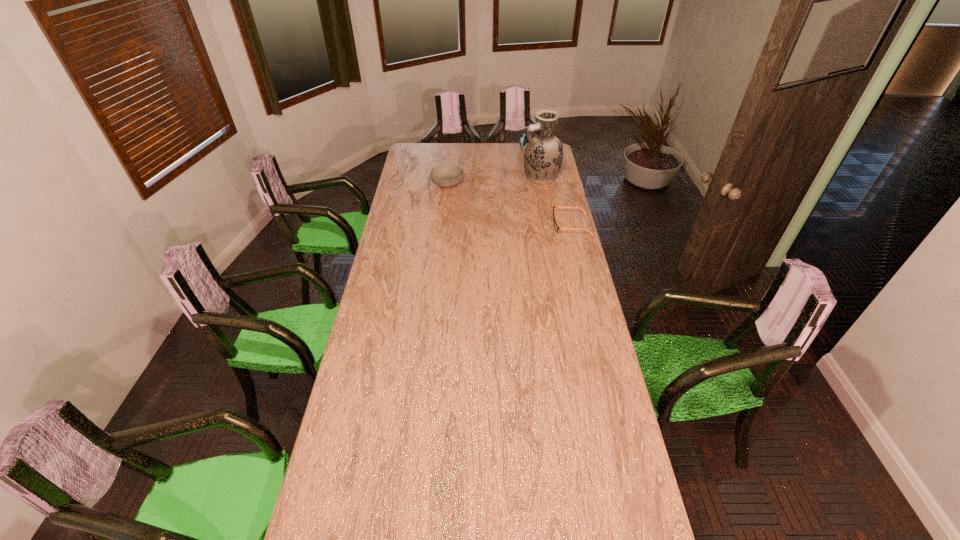
The image size is (960, 540). I want to click on headset positioned at the right edge, so click(522, 138).

At what (x,y) coordinates should I click in order to perform the action: click on object that is at the far right corner. Please return your answer as a coordinate pair (x, y). Looking at the image, I should click on (522, 138).

In the image, there is a desktop. At what (x,y) coordinates should I click in order to perform the action: click on vacant space at the far edge. Please return your answer as a coordinate pair (x, y). The image size is (960, 540). Looking at the image, I should click on (520, 151).

The image size is (960, 540). Identify the location of vacant space at the near edge of the desktop. (505, 508).

Where is `free space at the left edge of the desktop`? This screenshot has width=960, height=540. free space at the left edge of the desktop is located at coordinates (374, 422).

Identify the location of free location at the right edge. (562, 313).

In the image, there is a desktop. At what (x,y) coordinates should I click in order to perform the action: click on vacant area at the far left corner. Please return your answer as a coordinate pair (x, y). Looking at the image, I should click on (407, 155).

At what (x,y) coordinates should I click in order to perform the action: click on empty space between the shortest object and the tallest object. Please return your answer as a coordinate pair (x, y). This screenshot has width=960, height=540. Looking at the image, I should click on 556,201.

Find the location of a particular element. empty space that is in between the third shortest object and the leftmost object is located at coordinates (492, 166).

This screenshot has height=540, width=960. Find the location of `unoccupied position between the spectacles and the tallest object`. unoccupied position between the spectacles and the tallest object is located at coordinates (556, 201).